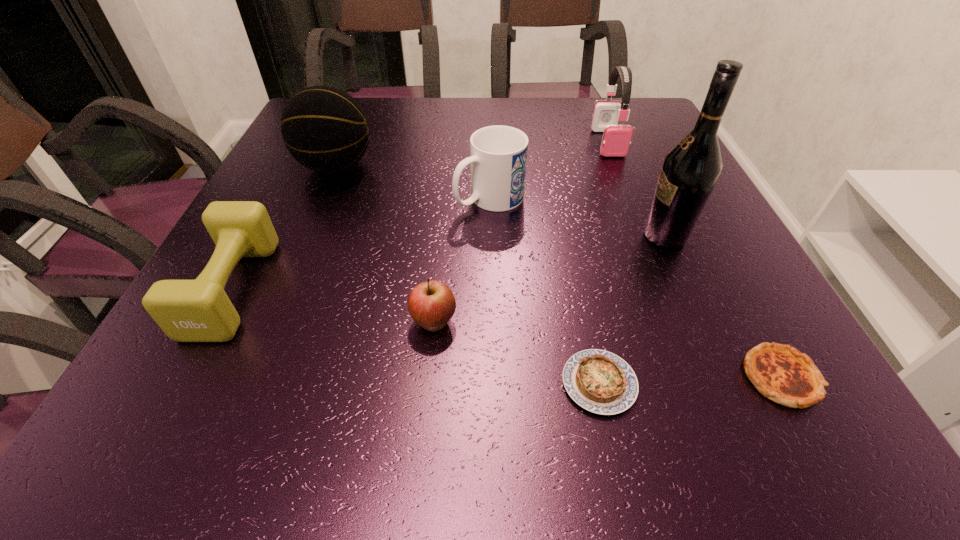
In order to click on vacant area at the right edge of the desktop in this screenshot , I will do `click(745, 259)`.

In the image, there is a desktop. Where is `vacant area at the near left corner`? This screenshot has width=960, height=540. vacant area at the near left corner is located at coordinates (175, 417).

Locate an element on the screen. The image size is (960, 540). vacant space at the far right corner of the desktop is located at coordinates (641, 126).

At what (x,y) coordinates should I click in order to perform the action: click on vacant area that lies between the fourth tallest object and the tallest object. Please return your answer as a coordinate pair (x, y). Looking at the image, I should click on (577, 217).

Where is `vacant area between the dumbbell and the fifth object from left to right`? The width and height of the screenshot is (960, 540). vacant area between the dumbbell and the fifth object from left to right is located at coordinates point(416,336).

This screenshot has width=960, height=540. In order to click on vacant area that lies between the fifth shortest object and the wine bottle in this screenshot , I will do `click(577, 217)`.

This screenshot has height=540, width=960. I want to click on free space between the earphone and the fourth tallest object, so click(x=548, y=171).

The width and height of the screenshot is (960, 540). I want to click on free space between the apple and the shorter quiche, so click(516, 353).

Locate an element on the screen. The width and height of the screenshot is (960, 540). free spot between the shorter quiche and the tallest object is located at coordinates (632, 309).

You are a GUI agent. You are given a task and a screenshot of the screen. Output one action in this format:
    pyautogui.click(x=<x>, y=<y>)
    Task: Click on the empty space between the right quiche and the mug
    
    Given the screenshot: What is the action you would take?
    pyautogui.click(x=635, y=288)